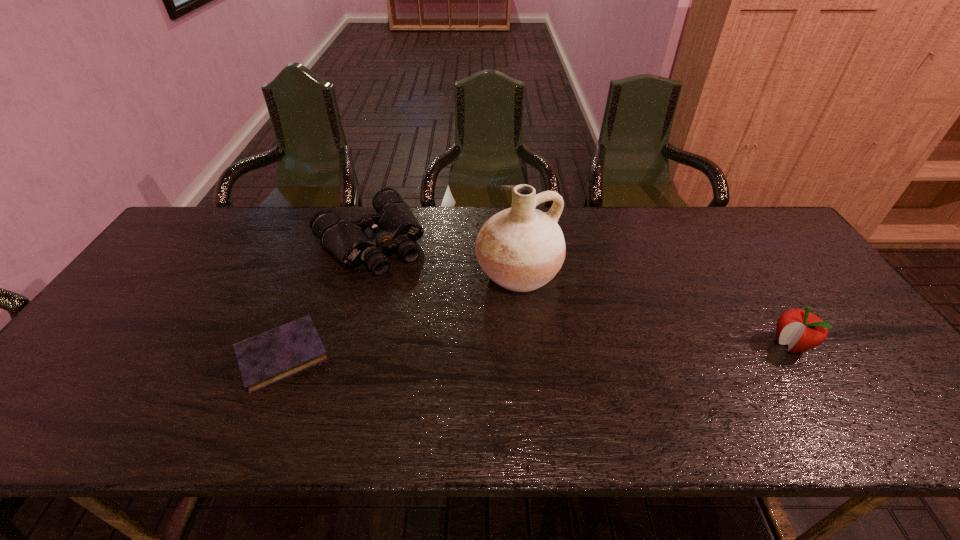
Identify the location of free space on the desktop that is between the shortest object and the rightmost object and is positioned through the eyepieces of the binoculars. This screenshot has height=540, width=960. (471, 351).

You are a GUI agent. You are given a task and a screenshot of the screen. Output one action in this format:
    pyautogui.click(x=<x>, y=<y>)
    Task: Click on the free space on the desktop that is between the shortest object and the rightmost object and is positioned to pour from the handle of the pottery
    This screenshot has width=960, height=540.
    Given the screenshot: What is the action you would take?
    pyautogui.click(x=583, y=349)